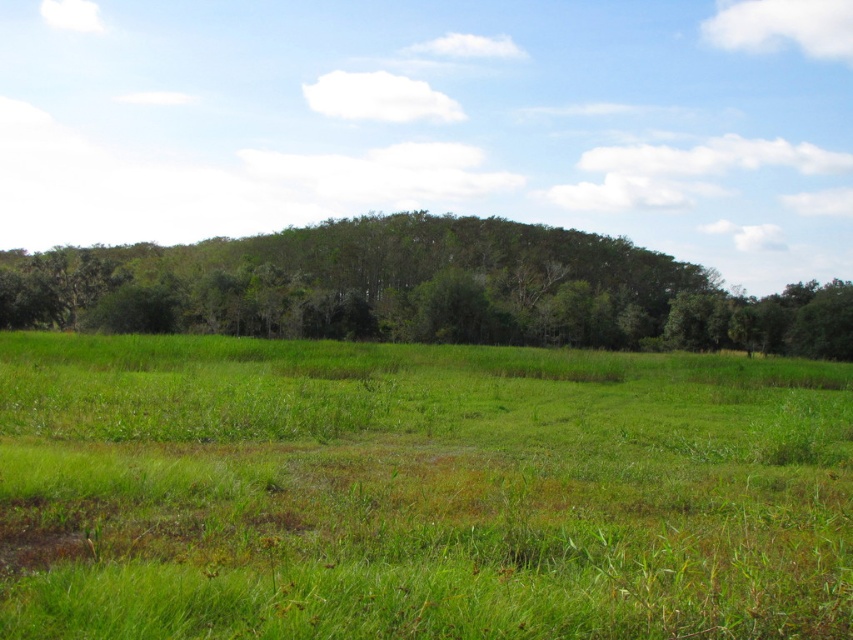
You are standing at the origin point in the image. Which direction should you move to reach the green grassy pasture at center?

The green grassy pasture at center is located at coordinates point [418,490], so you should move towards the right and slightly forward to reach it.

You are standing at the edge of the green grassy pasture at center and looking towards the green leafy trees at center. Which one is closer to you?

The green grassy pasture at center is closer to you because it is in front of the green leafy trees at center.

You are standing at point A located at coordinates point A at (370,500). You want to walk to point B which is 27.73 feet away. Can you reach point B without crossing the dense forest? Please explain your reasoning based on the scene description.

The dense cluster of trees forming a forested area in the midground is between the foreground grass and the background. Since point A is at (370,500), which is likely in the foreground, and point B is 27.73 feet away, you would need to traverse through the dense forest to reach it. The forest has closely packed trees with a thick canopy, making it difficult to pass through. Therefore, you cannot reach point B without crossing the dense forest.